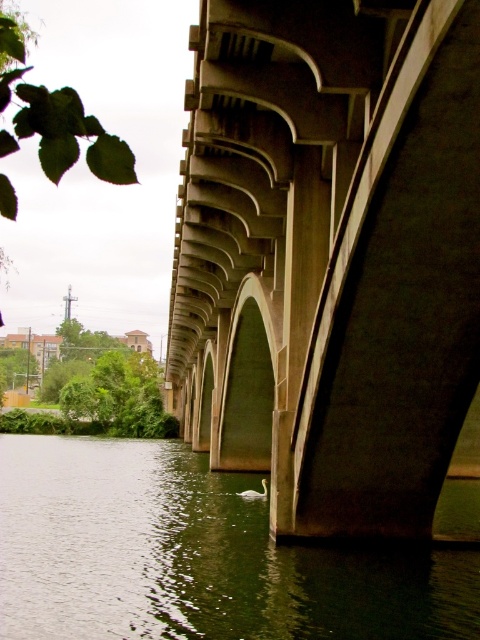
You are standing at the camera position and want to throw a pebble to hit the concrete at center. What is the approximate distance you need to throw the pebble?

The concrete at center is 10.24 meters away from the camera, so you need to throw the pebble approximately 10.24 meters to reach it.

You are standing on the bridge and looking down at the green smooth water at lower center. If you drop a small pebble into the water, where would the ripple start?

The ripple would start at the position of the green smooth water at lower center, which is at point [194,556].

You are standing on the bridge and want to observe the green smooth water at lower center and the concrete at center. Which object is higher from the ground?

The concrete at center is much taller than the green smooth water at lower center, so the concrete at center is higher from the ground.